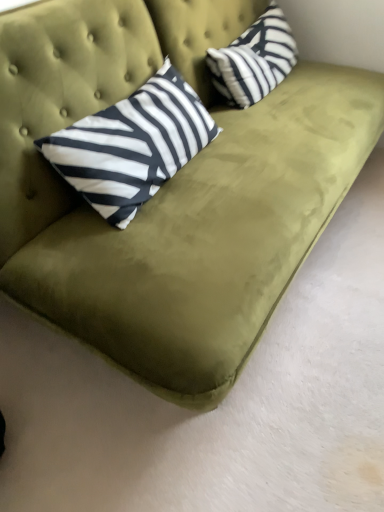
Question: Relative to white and black striped pillow at upper left, marked as the second pillow in a right-to-left arrangement, is black and white striped pillow at upper right, the 2th pillow positioned from the left, in front or behind?

Choices:
 (A) front
 (B) behind

Answer: (B)

Question: From a real-world perspective, is black and white striped pillow at upper right, positioned as the 1th pillow in right-to-left order, physically located above or below white and black striped pillow at upper left, marked as the second pillow in a right-to-left arrangement?

Choices:
 (A) above
 (B) below

Answer: (B)

Question: Considering the positions of point (228, 52) and point (127, 143), is point (228, 52) closer or farther from the camera than point (127, 143)?

Choices:
 (A) farther
 (B) closer

Answer: (A)

Question: Considering the positions of white and black striped pillow at upper left, marked as the second pillow in a right-to-left arrangement, and black and white striped pillow at upper right, the 2th pillow positioned from the left, in the image, is white and black striped pillow at upper left, marked as the second pillow in a right-to-left arrangement, wider or thinner than black and white striped pillow at upper right, the 2th pillow positioned from the left,?

Choices:
 (A) thin
 (B) wide

Answer: (B)

Question: Visually, is white and black striped pillow at upper left, the 1th pillow when ordered from left to right, positioned to the left or to the right of black and white striped pillow at upper right, the 2th pillow positioned from the left?

Choices:
 (A) right
 (B) left

Answer: (B)

Question: Which is correct: white and black striped pillow at upper left, marked as the second pillow in a right-to-left arrangement, is inside black and white striped pillow at upper right, positioned as the 1th pillow in right-to-left order, or outside of it?

Choices:
 (A) inside
 (B) outside

Answer: (B)

Question: In terms of size, does white and black striped pillow at upper left, the 1th pillow when ordered from left to right, appear bigger or smaller than black and white striped pillow at upper right, positioned as the 1th pillow in right-to-left order?

Choices:
 (A) small
 (B) big

Answer: (B)